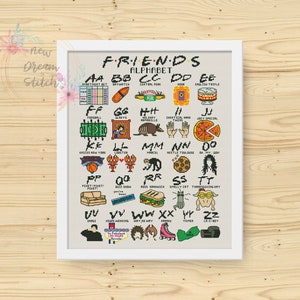
Identify the location of frame. (139, 255).